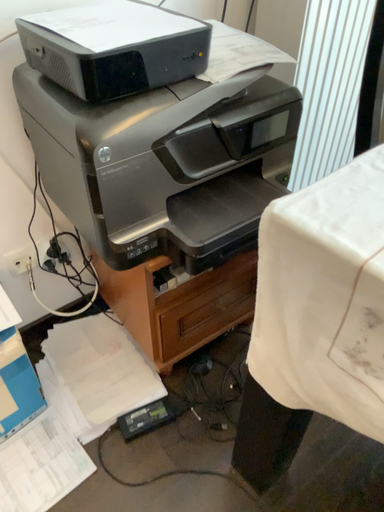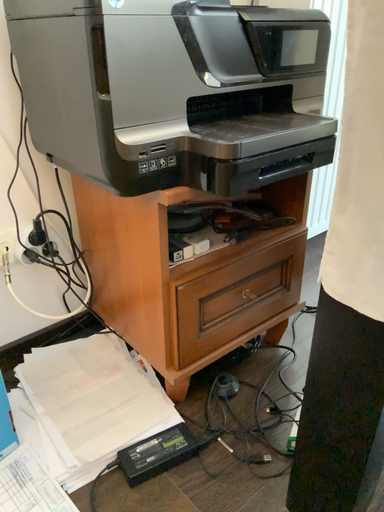
Question: How did the camera likely rotate when shooting the video?

Choices:
 (A) rotated downward
 (B) rotated upward

Answer: (B)